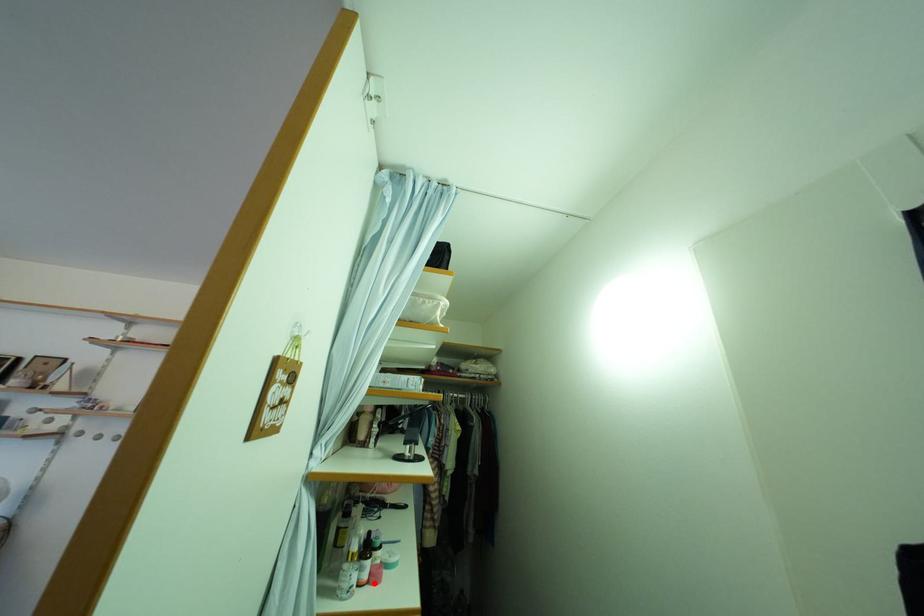
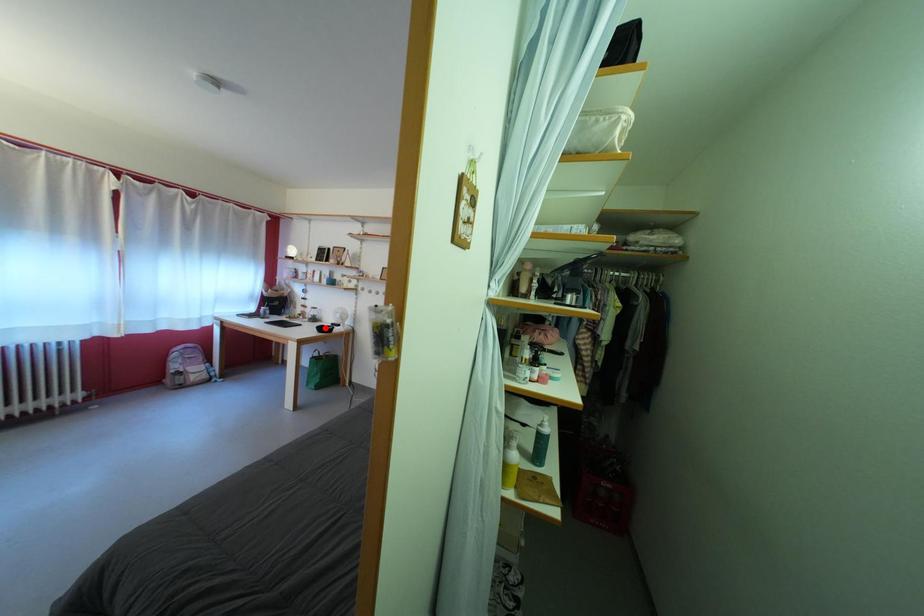
I am providing you with two images of the same scene from different viewpoints. A red point is marked on the first image and another point is marked on the second image. Do the highlighted points in image1 and image2 indicate the same real-world spot?

No